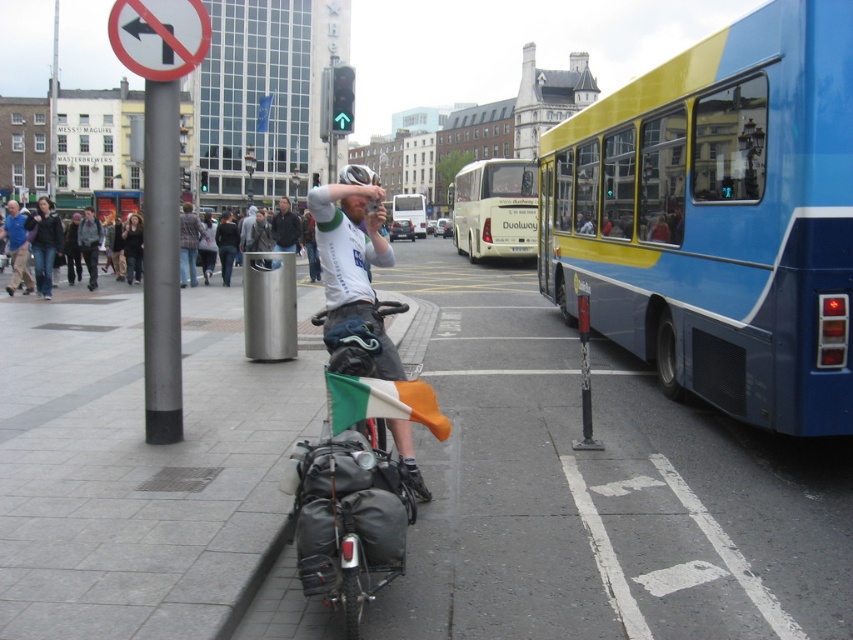
Does point (161, 170) come in front of point (399, 408)?

No.

Between black metal pole at left and irish flag at center, which one has more height?

With more height is black metal pole at left.

Who is more forward, (177, 252) or (369, 417)?

Positioned in front is point (369, 417).

I want to click on black metal pole at left, so click(x=161, y=262).

Find the location of `blue metallic bus at right`. blue metallic bus at right is located at coordinates (718, 218).

Which of these two, blue metallic bus at right or white plastic sign at upper left, stands shorter?

With less height is white plastic sign at upper left.

Consider the image. Measure the distance between blue metallic bus at right and camera.

blue metallic bus at right is 4.99 meters away from camera.

Locate an element on the screen. blue metallic bus at right is located at coordinates (718, 218).

Which is below, gray concrete sidewalk at center or yellow and blue bus at center?

gray concrete sidewalk at center is lower down.

Is gray concrete sidewalk at center further to the viewer compared to yellow and blue bus at center?

No, it is not.

Image resolution: width=853 pixels, height=640 pixels. Describe the element at coordinates (596, 488) in the screenshot. I see `gray concrete sidewalk at center` at that location.

You are a GUI agent. You are given a task and a screenshot of the screen. Output one action in this format:
    pyautogui.click(x=<x>, y=<y>)
    Task: Click on the gray concrete sidewalk at center
    The height and width of the screenshot is (640, 853).
    Given the screenshot: What is the action you would take?
    [596, 488]